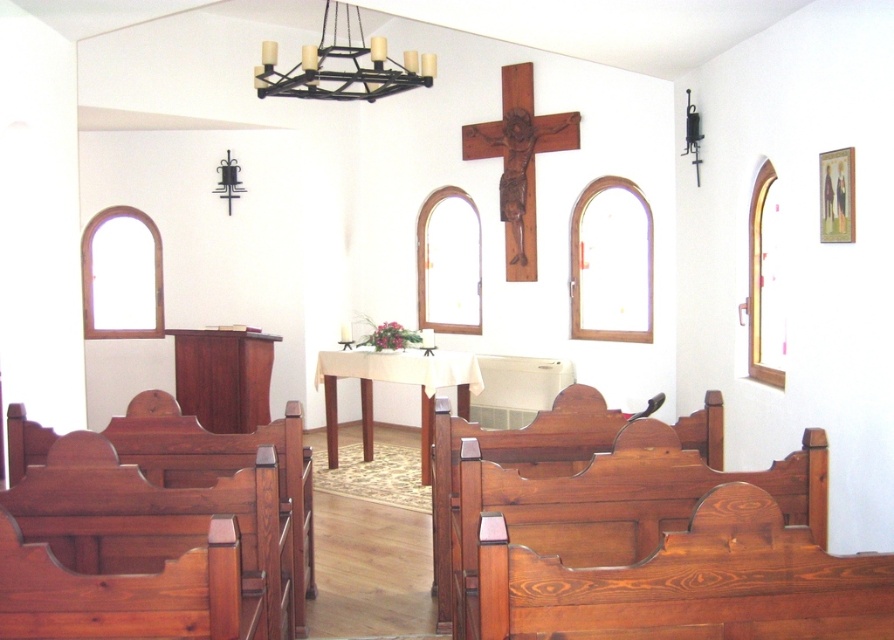
Question: Is polished wood church bench at lower right to the left of black metal chandelier at upper center from the viewer's perspective?

Choices:
 (A) yes
 (B) no

Answer: (B)

Question: Among these points, which one is farthest from the camera?

Choices:
 (A) (513, 116)
 (B) (388, 72)

Answer: (A)

Question: Which point is farther to the camera?

Choices:
 (A) (521, 192)
 (B) (406, 51)
 (C) (563, 593)
 (D) (149, 540)

Answer: (A)

Question: Is polished wood church bench at lower right smaller than black metal chandelier at upper center?

Choices:
 (A) yes
 (B) no

Answer: (A)

Question: Which of these objects is positioned closest to the black metal chandelier at upper center?

Choices:
 (A) wooden crucifix at center
 (B) polished wood church bench at lower right

Answer: (A)

Question: Is polished wood church bench at lower right behind polished wood church bench at lower left?

Choices:
 (A) no
 (B) yes

Answer: (A)